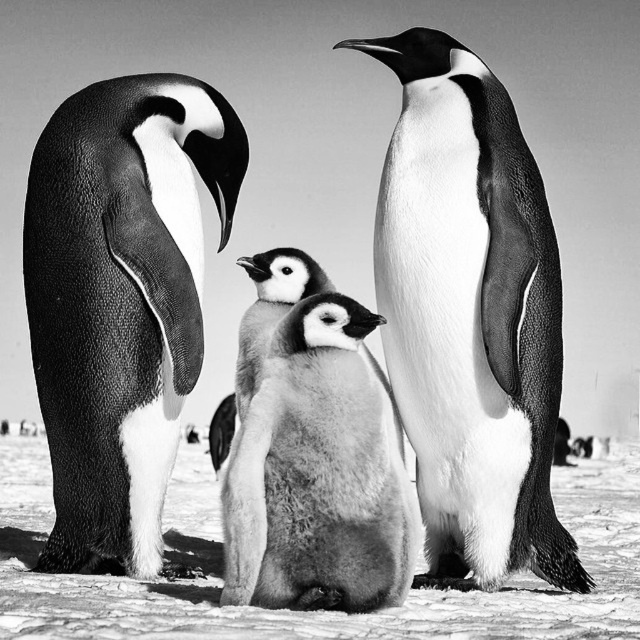
In the black and white photograph of the penguins in a snowy environment, there is a smooth black penguin at center and a soft yellow down at center. Which one is positioned higher in the image?

The smooth black penguin at center is located above the soft yellow down at center, so it is positioned higher in the image.

You are a researcher studying penguin behavior and need to place a tracking device on the smooth black penguin at center. Given that your device has a range of 0.5 units, can you determine if the device can reach the penguin from your current position at point A located at coordinates 0.5, 0.7?

The smooth black penguin at center is located at point (470, 314). The distance between your position at (448, 320) and the penguin is approximately 0.05 units, which is within the device range of 0.5 units. Therefore, the device can reach the penguin.